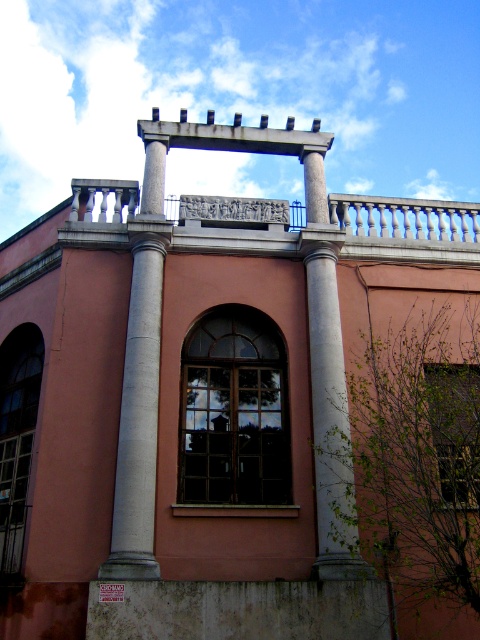
Image resolution: width=480 pixels, height=640 pixels. Describe the element at coordinates (233, 412) in the screenshot. I see `matte glass window at center` at that location.

Can you confirm if matte glass window at center is positioned above smooth concrete column at center?

No, matte glass window at center is not above smooth concrete column at center.

Measure the distance between matte glass window at center and camera.

They are 101.51 feet apart.

Image resolution: width=480 pixels, height=640 pixels. Find the location of `matte glass window at center`. matte glass window at center is located at coordinates click(x=233, y=412).

In the scene shown: Who is more forward, (x=332, y=291) or (x=28, y=452)?

Positioned in front is point (x=332, y=291).

Does smooth concrete column at center have a larger size compared to clear glass window at lower left?

Yes.

Who is more distant from viewer, (320, 524) or (29, 397)?

Point (29, 397)

Locate an element on the screen. The width and height of the screenshot is (480, 640). smooth concrete column at center is located at coordinates (x=327, y=387).

Which is in front, point (469, 252) or point (143, 506)?

Positioned in front is point (143, 506).

Does point (412, 244) come farther from viewer compared to point (147, 561)?

Yes.

Is point (354, 248) positioned after point (133, 499)?

Yes, it is.

I want to click on gray stone balustrade at center, so click(406, 228).